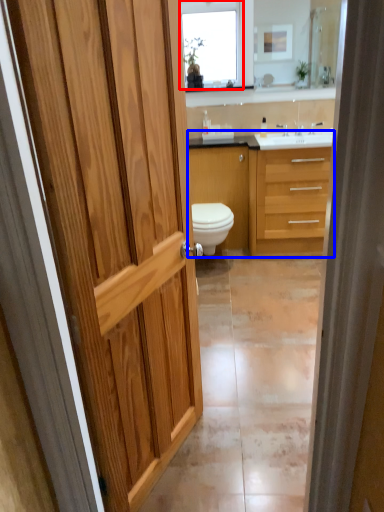
Question: Among these objects, which one is nearest to the camera, window (highlighted by a red box) or bathroom cabinet (highlighted by a blue box)?

Choices:
 (A) window
 (B) bathroom cabinet

Answer: (B)